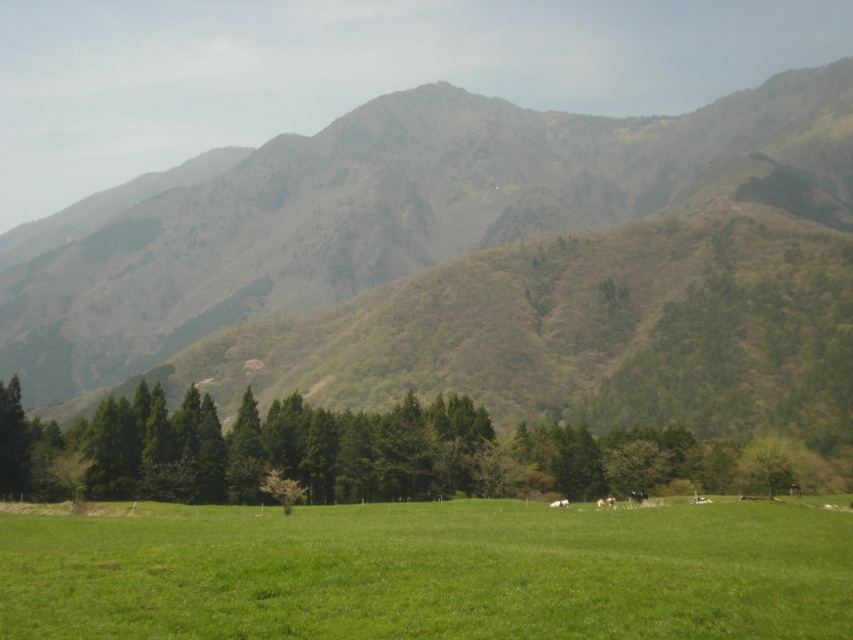
Question: From the image, what is the correct spatial relationship of green grassy hillside at center in relation to green grass pasture at center?

Choices:
 (A) left
 (B) right

Answer: (B)

Question: Can you confirm if green grassy hillside at center is bigger than green grass pasture at center?

Choices:
 (A) no
 (B) yes

Answer: (B)

Question: Which point is closer to the camera?

Choices:
 (A) green grassy hillside at center
 (B) green textured trees at center

Answer: (B)

Question: Which object is closer to the camera taking this photo?

Choices:
 (A) green textured trees at center
 (B) green grass pasture at center

Answer: (B)

Question: Among these objects, which one is nearest to the camera?

Choices:
 (A) green textured trees at center
 (B) green grass pasture at center
 (C) green grassy hillside at center

Answer: (B)

Question: Is green grass pasture at center positioned before green textured trees at center?

Choices:
 (A) no
 (B) yes

Answer: (B)